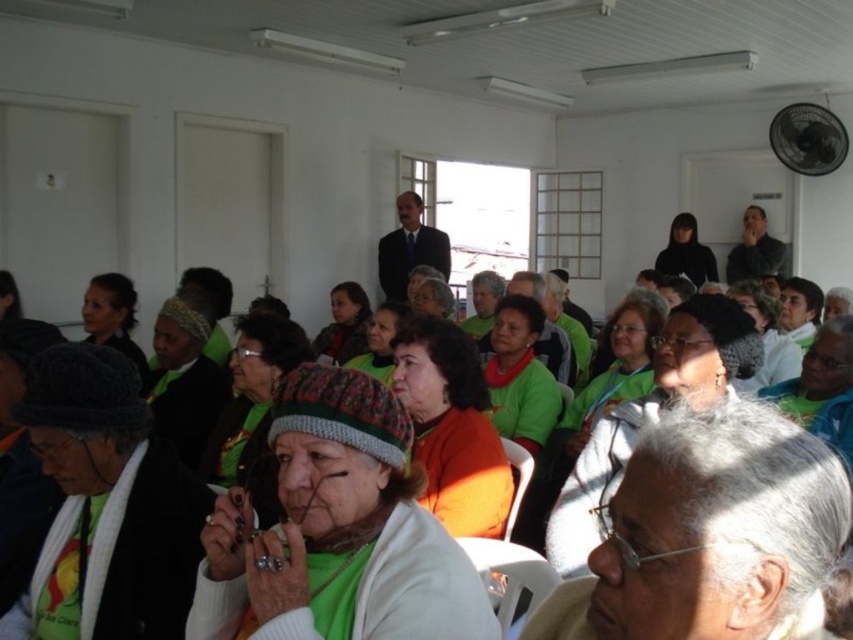
Question: Is green knitted hat at center smaller than dark suit at center?

Choices:
 (A) no
 (B) yes

Answer: (B)

Question: Estimate the real-world distances between objects in this image. Which object is farther from the dark suit at center?

Choices:
 (A) green knitted hat at center
 (B) green fabric at center

Answer: (A)

Question: Is green knitted hat at center above green fabric at center?

Choices:
 (A) no
 (B) yes

Answer: (A)

Question: Among these points, which one is farthest from the camera?

Choices:
 (A) (222, 532)
 (B) (288, 541)
 (C) (408, 250)

Answer: (C)

Question: Which object is farther from the camera taking this photo?

Choices:
 (A) green knitted hat at center
 (B) green fabric at center

Answer: (B)

Question: Is green knitted hat at center behind green fabric at center?

Choices:
 (A) no
 (B) yes

Answer: (A)